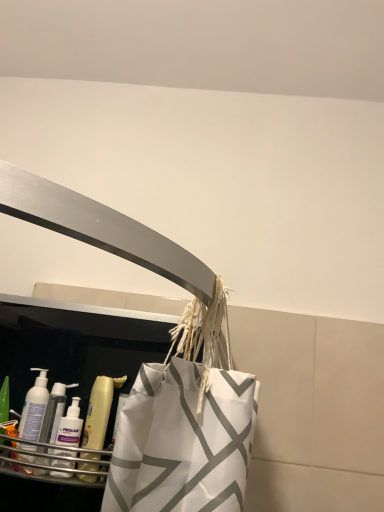
Question: Based on their sizes in the image, would you say white plastic bottle at lower left, which is the second cleaning product from right to left, is bigger or smaller than translucent plastic mouthwash at lower left?

Choices:
 (A) big
 (B) small

Answer: (A)

Question: Based on their positions, is white plastic bottle at lower left, which is the second cleaning product from right to left, located to the left or right of translucent plastic mouthwash at lower left?

Choices:
 (A) left
 (B) right

Answer: (A)

Question: Which object is the closest to the translucent plastic bottle at left, marked as the second cleaning product in a left-to-right arrangement?

Choices:
 (A) translucent plastic mouthwash at lower left
 (B) white plastic bottle at lower left, which is the second cleaning product from right to left

Answer: (B)

Question: Based on their relative distances, which object is nearer to the white plastic bottle at lower left, which is the 1th cleaning product in left-to-right order?

Choices:
 (A) translucent plastic bottle at left, which is counted as the 1th cleaning product, starting from the right
 (B) translucent plastic mouthwash at lower left

Answer: (A)